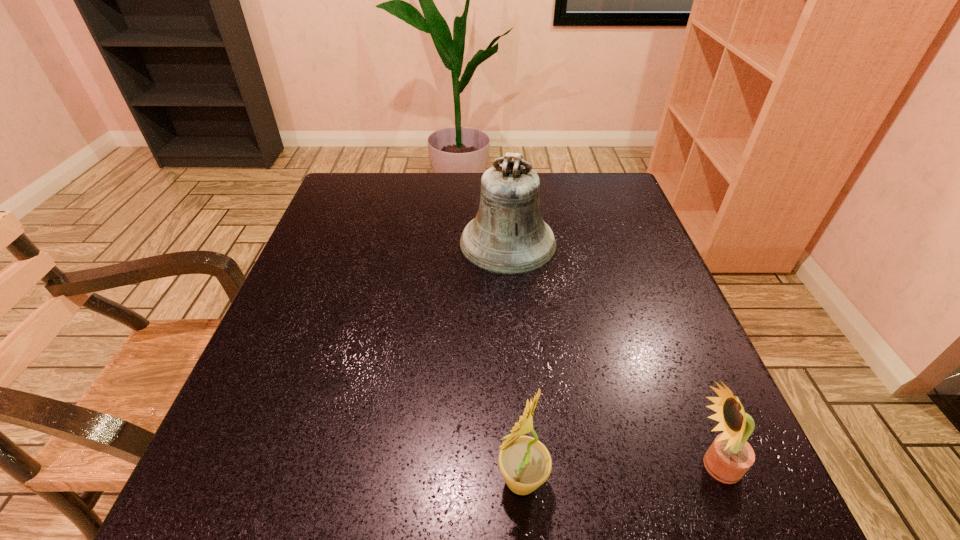
This screenshot has width=960, height=540. I want to click on free space between the bell and the right sunflower, so click(612, 354).

Locate an element on the screen. Image resolution: width=960 pixels, height=540 pixels. vacant space that's between the rightmost object and the left sunflower is located at coordinates (618, 473).

Locate an element on the screen. Image resolution: width=960 pixels, height=540 pixels. blank region between the left sunflower and the farthest object is located at coordinates (515, 361).

At what (x,y) coordinates should I click in order to perform the action: click on free area in between the farthest object and the left sunflower. Please return your answer as a coordinate pair (x, y). The image size is (960, 540). Looking at the image, I should click on (515, 361).

Where is `free point between the right sunflower and the left sunflower`? The image size is (960, 540). free point between the right sunflower and the left sunflower is located at coordinates (618, 473).

This screenshot has height=540, width=960. I want to click on vacant region between the left sunflower and the rightmost object, so click(618, 473).

The height and width of the screenshot is (540, 960). In order to click on free space between the rightmost object and the left sunflower in this screenshot , I will do `click(618, 473)`.

I want to click on vacant region between the left sunflower and the farthest object, so click(515, 361).

This screenshot has width=960, height=540. Identify the location of free spot between the left sunflower and the rightmost object. (618, 473).

You are a GUI agent. You are given a task and a screenshot of the screen. Output one action in this format:
    pyautogui.click(x=<x>, y=<y>)
    Task: Click on the object that is the closest to the farthest object
    Image resolution: width=960 pixels, height=540 pixels.
    Given the screenshot: What is the action you would take?
    pyautogui.click(x=730, y=456)